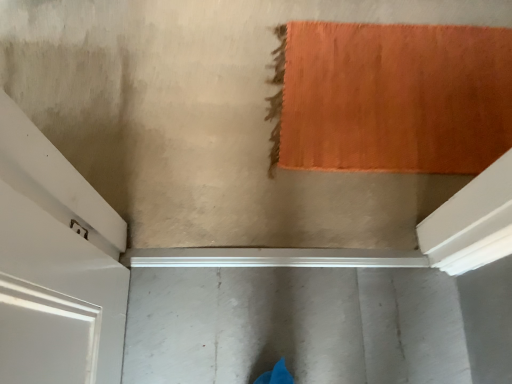
This screenshot has height=384, width=512. I want to click on empty space that is ontop of gray concrete at center (from a real-world perspective), so click(x=270, y=306).